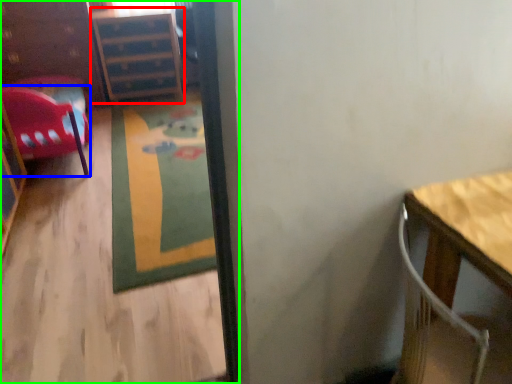
Question: Estimate the real-world distances between objects in this image. Which object is closer to file cabinet (highlighted by a red box), chair (highlighted by a blue box) or corridor (highlighted by a green box)?

Choices:
 (A) chair
 (B) corridor

Answer: (A)